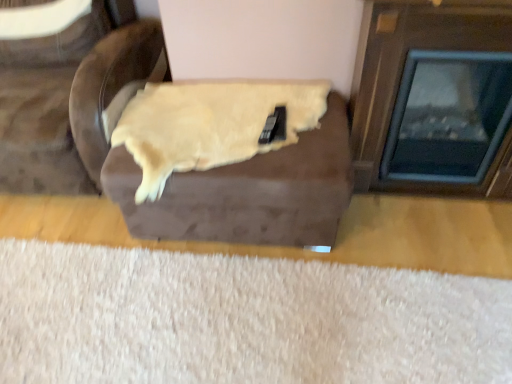
Question: From a real-world perspective, is brown suede ottoman at center, the second furniture in the left-to-right sequence, physically above brown suede armchair at upper left, acting as the first furniture starting from the left?

Choices:
 (A) yes
 (B) no

Answer: (B)

Question: Are brown suede ottoman at center, the second furniture in the left-to-right sequence, and brown suede armchair at upper left, the 2th furniture viewed from the right, located far from each other?

Choices:
 (A) yes
 (B) no

Answer: (B)

Question: Is brown suede ottoman at center, the first furniture when ordered from right to left, closer to camera compared to brown suede armchair at upper left, the 2th furniture viewed from the right?

Choices:
 (A) yes
 (B) no

Answer: (B)

Question: Is brown suede ottoman at center, the first furniture when ordered from right to left, smaller than brown suede armchair at upper left, the 2th furniture viewed from the right?

Choices:
 (A) no
 (B) yes

Answer: (B)

Question: From a real-world perspective, is brown suede ottoman at center, the second furniture in the left-to-right sequence, under brown suede armchair at upper left, the 2th furniture viewed from the right?

Choices:
 (A) no
 (B) yes

Answer: (B)

Question: Is brown suede ottoman at center, the second furniture in the left-to-right sequence, in front of or behind wooden fireplace at right in the image?

Choices:
 (A) front
 (B) behind

Answer: (B)

Question: In the image, is brown suede ottoman at center, the second furniture in the left-to-right sequence, on the left side or the right side of wooden fireplace at right?

Choices:
 (A) left
 (B) right

Answer: (A)

Question: From the image's perspective, is brown suede ottoman at center, the second furniture in the left-to-right sequence, above or below wooden fireplace at right?

Choices:
 (A) below
 (B) above

Answer: (A)

Question: From a real-world perspective, relative to wooden fireplace at right, is brown suede ottoman at center, the second furniture in the left-to-right sequence, vertically above or below?

Choices:
 (A) above
 (B) below

Answer: (B)

Question: Is brown suede armchair at upper left, the 2th furniture viewed from the right, inside or outside of wooden fireplace at right?

Choices:
 (A) inside
 (B) outside

Answer: (B)

Question: Is point (11, 6) positioned closer to the camera than point (486, 165)?

Choices:
 (A) closer
 (B) farther

Answer: (B)

Question: From a real-world perspective, relative to wooden fireplace at right, is brown suede armchair at upper left, the 2th furniture viewed from the right, vertically above or below?

Choices:
 (A) below
 (B) above

Answer: (A)

Question: Is brown suede armchair at upper left, the 2th furniture viewed from the right, taller or shorter than wooden fireplace at right?

Choices:
 (A) tall
 (B) short

Answer: (A)

Question: Looking at the image, does white fluffy rug at lower center seem bigger or smaller compared to brown suede armchair at upper left, the 2th furniture viewed from the right?

Choices:
 (A) big
 (B) small

Answer: (B)

Question: Considering their positions, is white fluffy rug at lower center located in front of or behind brown suede armchair at upper left, the 2th furniture viewed from the right?

Choices:
 (A) front
 (B) behind

Answer: (A)